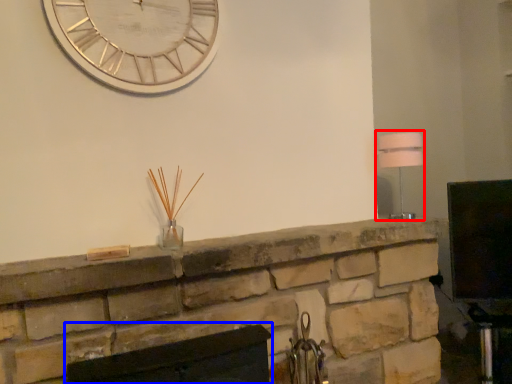
Question: Among these objects, which one is farthest to the camera, lamp (highlighted by a red box) or fireplace (highlighted by a blue box)?

Choices:
 (A) lamp
 (B) fireplace

Answer: (A)